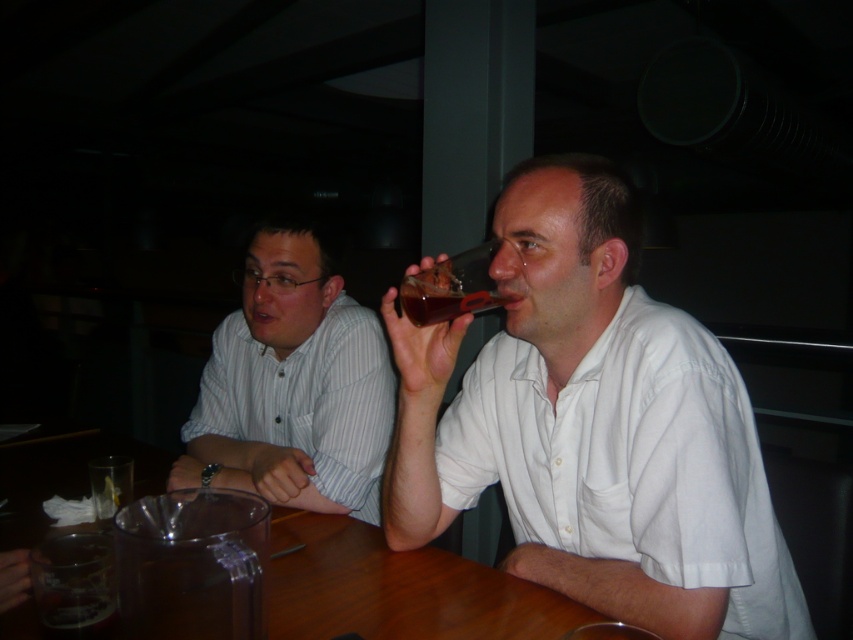
Can you confirm if wooden table at center is thinner than translucent plastic cup at upper right?

Incorrect, wooden table at center's width is not less than translucent plastic cup at upper right's.

Who is taller, wooden table at center or translucent plastic cup at upper right?

translucent plastic cup at upper right

What do you see at coordinates (397, 588) in the screenshot? I see `wooden table at center` at bounding box center [397, 588].

The width and height of the screenshot is (853, 640). Find the location of `wooden table at center`. wooden table at center is located at coordinates (397, 588).

Is the position of white striped shirt at left more distant than that of wooden table at center?

Yes, white striped shirt at left is further from the viewer.

Measure the distance between point (373,452) and camera.

The distance of point (373,452) from camera is 1.40 meters.

Who is more distant from viewer, (204, 426) or (523, 582)?

Point (204, 426)

Identify the location of white striped shirt at left. (292, 385).

Does white cotton shirt at upper right appear on the left side of translucent plastic cup at upper right?

Incorrect, white cotton shirt at upper right is not on the left side of translucent plastic cup at upper right.

Is white cotton shirt at upper right above translucent plastic cup at upper right?

Incorrect, white cotton shirt at upper right is not positioned above translucent plastic cup at upper right.

Which is in front, point (543, 212) or point (494, 288)?

Point (543, 212) is more forward.

You are a GUI agent. You are given a task and a screenshot of the screen. Output one action in this format:
    pyautogui.click(x=<x>, y=<y>)
    Task: Click on the white cotton shirt at upper right
    
    Given the screenshot: What is the action you would take?
    pyautogui.click(x=593, y=426)